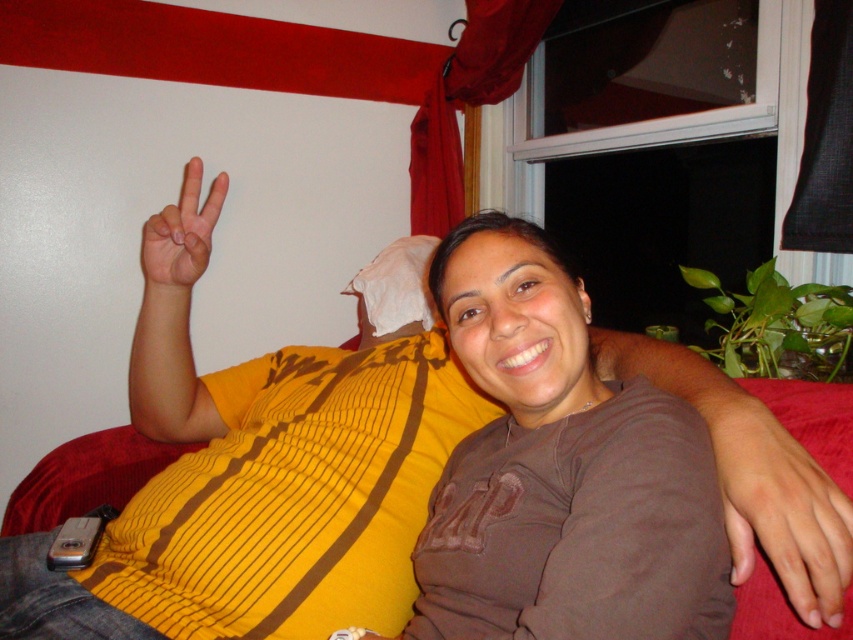
Question: Does brown soft shirt at center come in front of matte yellow hand at upper left?

Choices:
 (A) yes
 (B) no

Answer: (A)

Question: Which point is closer to the camera?

Choices:
 (A) pale skin hand at center
 (B) brown soft shirt at center

Answer: (B)

Question: Which object is the closest to the matte yellow hand at upper left?

Choices:
 (A) pale skin hand at center
 (B) brown soft shirt at center

Answer: (B)

Question: Which point appears farthest from the camera in this image?

Choices:
 (A) click(x=161, y=250)
 (B) click(x=811, y=388)
 (C) click(x=483, y=432)

Answer: (A)

Question: Can you confirm if pale skin hand at center is positioned to the right of matte yellow hand at upper left?

Choices:
 (A) no
 (B) yes

Answer: (B)

Question: Is pale skin hand at center positioned in front of matte yellow hand at upper left?

Choices:
 (A) no
 (B) yes

Answer: (B)